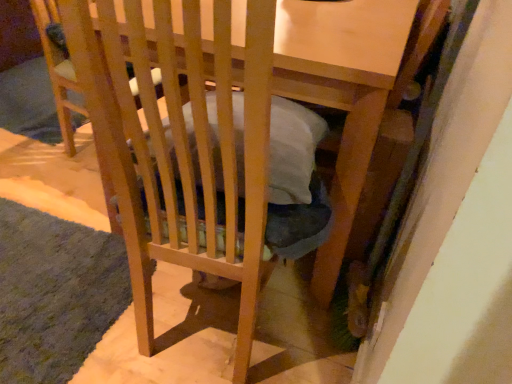
What is the approximate height of green shaggy rug at lower left?

4.73 centimeters.

What do you see at coordinates (55, 293) in the screenshot? The width and height of the screenshot is (512, 384). I see `green shaggy rug at lower left` at bounding box center [55, 293].

Locate an element on the screen. The image size is (512, 384). green shaggy rug at lower left is located at coordinates (55, 293).

Describe the element at coordinates (58, 70) in the screenshot. This screenshot has height=384, width=512. I see `wooden folding chair at center` at that location.

In order to face wooden folding chair at center, should I rotate leftwards or rightwards?

Rotate your view left by about 18.533°.

Measure the distance between point (x=59, y=99) and camera.

The depth of point (x=59, y=99) is 1.78 meters.

Where is `wooden folding chair at center`? The width and height of the screenshot is (512, 384). wooden folding chair at center is located at coordinates (58, 70).

Find the location of `green shaggy rug at lower left`. green shaggy rug at lower left is located at coordinates (55, 293).

Considering the positions of objects wooden folding chair at center and green shaggy rug at lower left in the image provided, who is more to the left, wooden folding chair at center or green shaggy rug at lower left?

Positioned to the left is green shaggy rug at lower left.

Which is behind, wooden folding chair at center or green shaggy rug at lower left?

wooden folding chair at center is more distant.

Does point (73, 84) come behind point (80, 297)?

Yes, it is behind point (80, 297).

In the scene shown: From the image's perspective, does wooden folding chair at center appear lower than green shaggy rug at lower left?

Actually, wooden folding chair at center appears above green shaggy rug at lower left in the image.

From a real-world perspective, is wooden folding chair at center under green shaggy rug at lower left?

No, from a real-world perspective, wooden folding chair at center is not beneath green shaggy rug at lower left.

Between wooden folding chair at center and green shaggy rug at lower left, which one has smaller width?

wooden folding chair at center.

Considering the sizes of wooden folding chair at center and green shaggy rug at lower left in the image, is wooden folding chair at center taller or shorter than green shaggy rug at lower left?

Clearly, wooden folding chair at center is taller compared to green shaggy rug at lower left.

In the scene shown: Between wooden folding chair at center and green shaggy rug at lower left, which one has larger size?

wooden folding chair at center is bigger.

Is green shaggy rug at lower left completely or partially inside wooden folding chair at center?

No.

Is wooden folding chair at center touching green shaggy rug at lower left?

No, wooden folding chair at center is not making contact with green shaggy rug at lower left.

Is green shaggy rug at lower left at the back of wooden folding chair at center?

That's not correct — wooden folding chair at center is not looking away from green shaggy rug at lower left.

Based on the photo, how many degrees apart are the facing directions of wooden folding chair at center and green shaggy rug at lower left?

The facing directions of wooden folding chair at center and green shaggy rug at lower left are 98.7 degrees apart.

In the image, there is a green shaggy rug at lower left. At what (x,y) coordinates should I click in order to perform the action: click on folding chair above it (from the image's perspective). Please return your answer as a coordinate pair (x, y). The height and width of the screenshot is (384, 512). Looking at the image, I should click on (58, 70).

Visually, is green shaggy rug at lower left positioned to the left or to the right of wooden folding chair at center?

green shaggy rug at lower left is positioned on wooden folding chair at center's left side.

Is green shaggy rug at lower left positioned behind wooden folding chair at center?

No, the depth of green shaggy rug at lower left is less than that of wooden folding chair at center.

Does point (54, 341) come closer to viewer compared to point (59, 108)?

Yes.

From the image's perspective, which object appears higher, green shaggy rug at lower left or wooden folding chair at center?

wooden folding chair at center is shown above in the image.

From a real-world perspective, is green shaggy rug at lower left positioned over wooden folding chair at center based on gravity?

No.

Between green shaggy rug at lower left and wooden folding chair at center, which one has larger width?

With larger width is green shaggy rug at lower left.

Is green shaggy rug at lower left taller or shorter than wooden folding chair at center?

green shaggy rug at lower left is shorter than wooden folding chair at center.

Can you confirm if green shaggy rug at lower left is bigger than wooden folding chair at center?

Incorrect, green shaggy rug at lower left is not larger than wooden folding chair at center.

Is green shaggy rug at lower left inside the boundaries of wooden folding chair at center, or outside?

green shaggy rug at lower left is outside wooden folding chair at center.

Does green shaggy rug at lower left touch wooden folding chair at center?

No, green shaggy rug at lower left is not next to wooden folding chair at center.

Is green shaggy rug at lower left facing towards wooden folding chair at center?

Yes, green shaggy rug at lower left is aimed at wooden folding chair at center.

How many degrees apart are the facing directions of green shaggy rug at lower left and wooden folding chair at center?

green shaggy rug at lower left and wooden folding chair at center are facing 98.7 degrees away from each other.

The height and width of the screenshot is (384, 512). What are the coordinates of `folding chair behind the green shaggy rug at lower left` in the screenshot? It's located at [58, 70].

Where is `folding chair above the green shaggy rug at lower left (from a real-world perspective)`? The image size is (512, 384). folding chair above the green shaggy rug at lower left (from a real-world perspective) is located at coordinates (58, 70).

Where is `folding chair lying behind the green shaggy rug at lower left`? The width and height of the screenshot is (512, 384). folding chair lying behind the green shaggy rug at lower left is located at coordinates (58, 70).